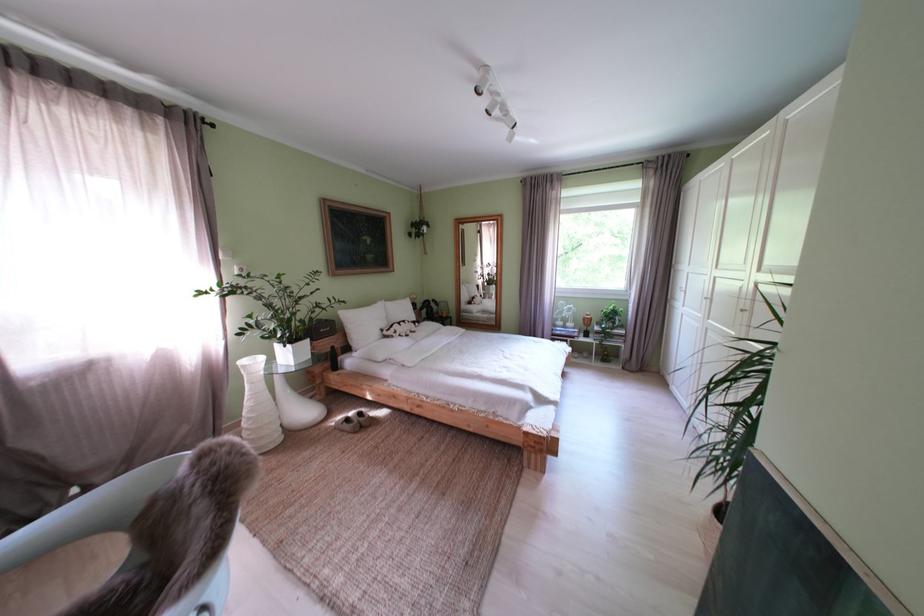
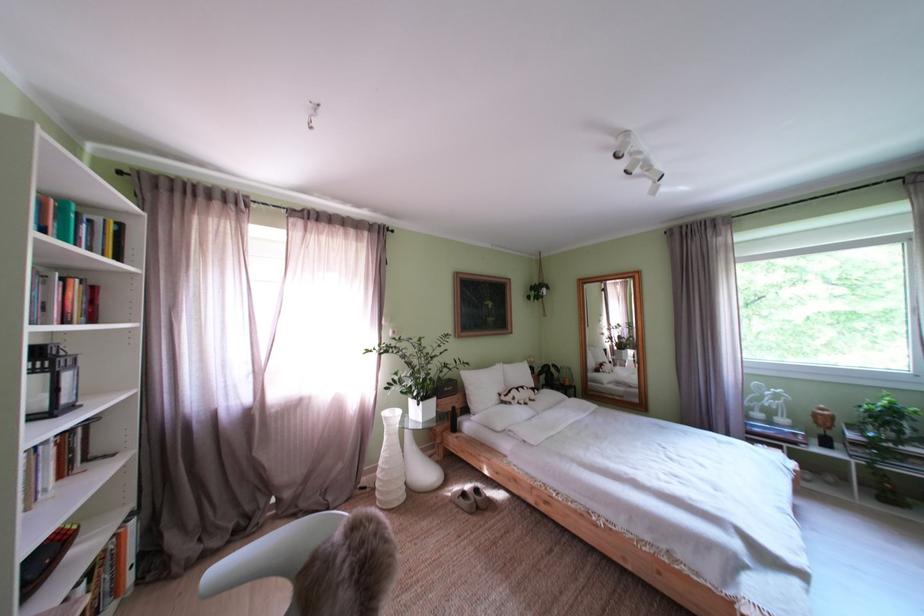
Locate, in the second image, the point that corresponds to pixel 359 424 in the first image.

(475, 500)